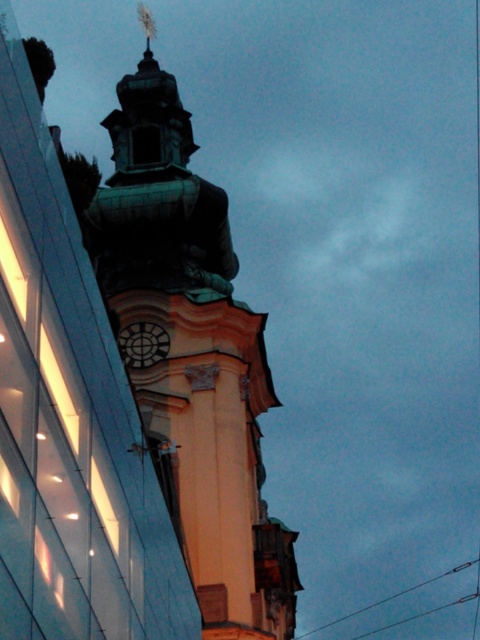
You are an architect analyzing the building layout. The green patina tower at center and the matte black clock at center are part of the same structure. Which object is located to the left of the other?

The matte black clock at center is located to the left of the green patina tower at center because the green patina tower at center is positioned on the right side of the matte black clock at center.

You are an architect evaluating the building facade. You notice the green patina tower at center and the matte black clock at center. Which object occupies more horizontal space in the image?

The green patina tower at center is wider than the matte black clock at center, so it occupies more horizontal space in the image.